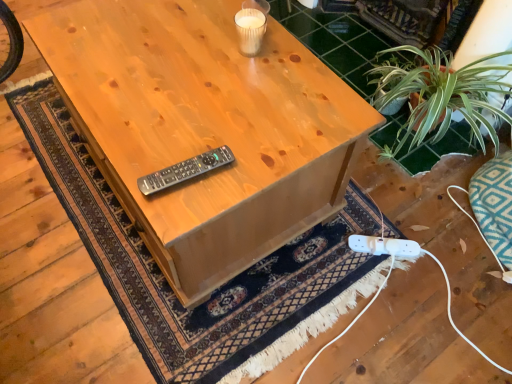
What are the coordinates of `vacant area that is in front of white plastic plug at lower right` in the screenshot? It's located at (370, 276).